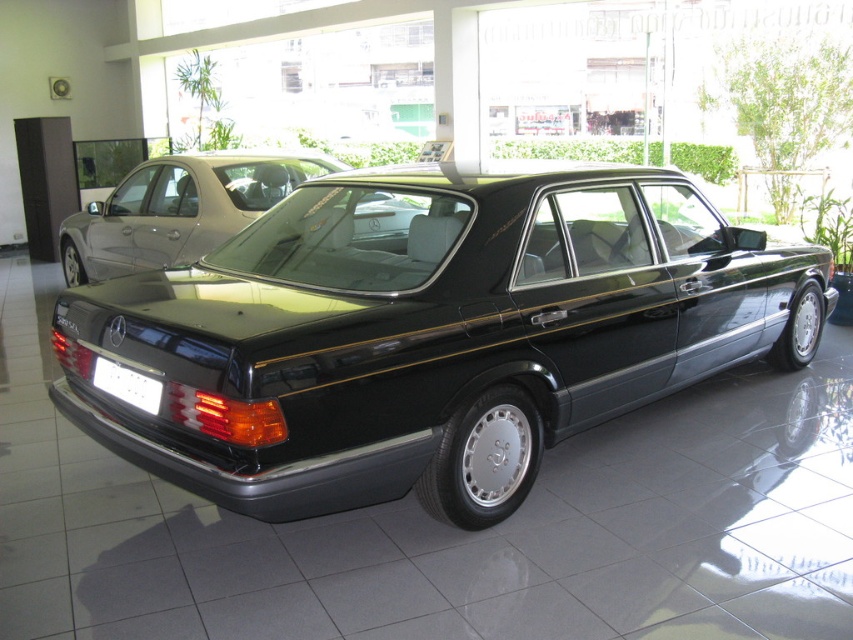
Question: Can you confirm if glossy black sedan at center is wider than white plastic license plate at rear?

Choices:
 (A) no
 (B) yes

Answer: (B)

Question: Does glossy black sedan at center lie behind white plastic license plate at rear?

Choices:
 (A) yes
 (B) no

Answer: (A)

Question: Which point appears farthest from the camera in this image?

Choices:
 (A) (68, 234)
 (B) (125, 365)
 (C) (700, 365)

Answer: (A)

Question: Which of the following is the closest to the observer?

Choices:
 (A) glossy black sedan at center
 (B) white plastic license plate at rear

Answer: (B)

Question: Does glossy black car at center appear over glossy black sedan at center?

Choices:
 (A) no
 (B) yes

Answer: (A)

Question: Which point is closer to the camera?

Choices:
 (A) (138, 385)
 (B) (403, 248)

Answer: (A)